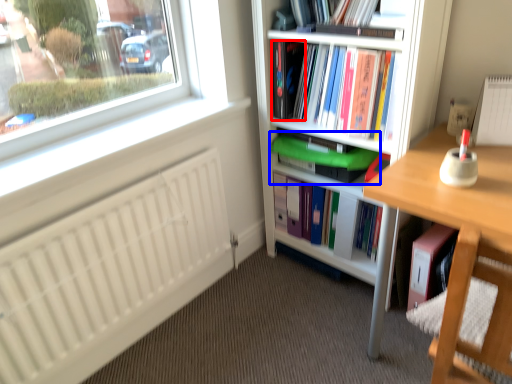
Question: Among these objects, which one is farthest to the camera, paperback book (highlighted by a red box) or book (highlighted by a blue box)?

Choices:
 (A) paperback book
 (B) book

Answer: (A)